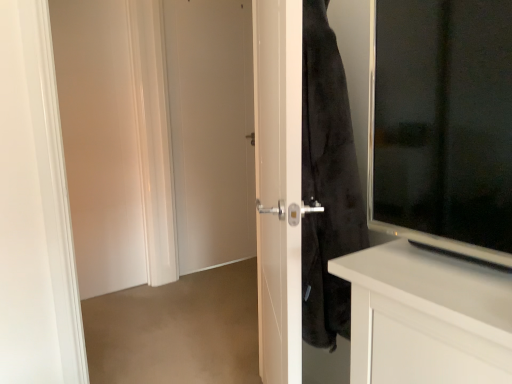
What is the approximate height of white glossy door at center, arranged as the first screen door when viewed from the right?

The height of white glossy door at center, arranged as the first screen door when viewed from the right, is 1.65 meters.

Where is `white matte door at left, the 2th screen door when ordered from front to back`? This screenshot has width=512, height=384. white matte door at left, the 2th screen door when ordered from front to back is located at coordinates (99, 143).

Is white matte door at center taller than white glossy door at center, arranged as the first screen door when viewed from the right?

Yes.

Can you tell me how much white matte door at center and white glossy door at center, which is the second screen door from back to front, differ in facing direction?

There is a 0.85-degree angle between the facing directions of white matte door at center and white glossy door at center, which is the second screen door from back to front.

Is the position of white matte door at center less distant than that of white glossy door at center, which ranks as the 2th screen door in left-to-right order?

No, white matte door at center is further to the viewer.

Is point (167, 41) closer or farther from the camera than point (102, 4)?

Clearly, point (167, 41) is more distant from the camera than point (102, 4).

Considering the positions of objects white matte door at left, which ranks as the first screen door in left-to-right order, and white glossy door at center, arranged as the first screen door when viewed from the right, in the image provided, who is in front, white matte door at left, which ranks as the first screen door in left-to-right order, or white glossy door at center, arranged as the first screen door when viewed from the right,?

white glossy door at center, arranged as the first screen door when viewed from the right.

Could you tell me if white matte door at left, the first screen door in the back-to-front sequence, is turned towards white glossy door at center, which is the second screen door from back to front?

Yes, white matte door at left, the first screen door in the back-to-front sequence, faces towards white glossy door at center, which is the second screen door from back to front.

Can white glossy door at center, which ranks as the 2th screen door in left-to-right order, be found inside white matte door at left, the 2th screen door when ordered from front to back?

No, white glossy door at center, which ranks as the 2th screen door in left-to-right order, is not inside white matte door at left, the 2th screen door when ordered from front to back.

Which is more to the left, white matte door at left, the 2th screen door positioned from the right, or white glossy door at center, positioned as the first screen door in front-to-back order?

Positioned to the left is white matte door at left, the 2th screen door positioned from the right.

Are white matte door at left, the 2th screen door when ordered from front to back, and white matte door at center located far from each other?

white matte door at left, the 2th screen door when ordered from front to back, is actually quite close to white matte door at center.

How different are the orientations of white matte door at left, the 2th screen door when ordered from front to back, and white matte door at center in degrees?

1.17 degrees.

From a real-world perspective, is white matte door at left, which ranks as the first screen door in left-to-right order, physically located above or below white matte door at center?

white matte door at left, which ranks as the first screen door in left-to-right order, is below white matte door at center.

In the image, is white matte door at left, the first screen door in the back-to-front sequence, on the left side or the right side of white matte door at center?

white matte door at left, the first screen door in the back-to-front sequence, is to the left of white matte door at center.

Could you tell me if white matte door at center is turned towards white matte door at left, the 2th screen door positioned from the right?

No, white matte door at center is not oriented towards white matte door at left, the 2th screen door positioned from the right.

How many degrees apart are the facing directions of white matte door at center and white matte door at left, which ranks as the first screen door in left-to-right order?

The facing directions of white matte door at center and white matte door at left, which ranks as the first screen door in left-to-right order, are 1.17 degrees apart.

Is point (175, 138) farther from viewer compared to point (91, 73)?

Yes, it is behind point (91, 73).

The height and width of the screenshot is (384, 512). What are the coordinates of `door that is above the white matte door at left, which ranks as the first screen door in left-to-right order (from a real-world perspective)` in the screenshot? It's located at (211, 129).

Which of these two, white glossy door at center, arranged as the first screen door when viewed from the right, or white matte door at center, is smaller?

Smaller between the two is white matte door at center.

Considering the positions of point (99, 289) and point (227, 55), is point (99, 289) closer or farther from the camera than point (227, 55)?

Point (99, 289) is positioned closer to the camera compared to point (227, 55).

Which object is further away from the camera taking this photo, white glossy door at center, arranged as the first screen door when viewed from the right, or white matte door at center?

white matte door at center is more distant.

From the image's perspective, between white glossy door at center, which is the second screen door from back to front, and white matte door at center, who is located below?

white glossy door at center, which is the second screen door from back to front.

From the picture: In terms of size, does white glossy door at center, which is the second screen door from back to front, appear bigger or smaller than white matte door at left, the 2th screen door positioned from the right?

Clearly, white glossy door at center, which is the second screen door from back to front, is larger in size than white matte door at left, the 2th screen door positioned from the right.

Is white matte door at left, the 2th screen door when ordered from front to back, at the back of white glossy door at center, arranged as the first screen door when viewed from the right?

Correct, white glossy door at center, arranged as the first screen door when viewed from the right, is looking away from white matte door at left, the 2th screen door when ordered from front to back.

Would you say white matte door at left, which ranks as the first screen door in left-to-right order, is part of white glossy door at center, which is the second screen door from back to front,'s contents?

Actually, white matte door at left, which ranks as the first screen door in left-to-right order, is outside white glossy door at center, which is the second screen door from back to front.

This screenshot has height=384, width=512. In order to click on the 2nd screen door below when counting from the white matte door at center (from the image's perspective) in this screenshot , I will do `click(232, 101)`.

Where is `screen door lying behind the white glossy door at center, which is the second screen door from back to front`? screen door lying behind the white glossy door at center, which is the second screen door from back to front is located at coordinates (99, 143).

Based on their spatial positions, is white matte door at left, the first screen door in the back-to-front sequence, or white glossy door at center, arranged as the first screen door when viewed from the right, further from white matte door at center?

Among the two, white matte door at left, the first screen door in the back-to-front sequence, is located further to white matte door at center.

From the image, which object appears to be nearer to white glossy door at center, which ranks as the 2th screen door in left-to-right order, white matte door at center or white matte door at left, the first screen door in the back-to-front sequence?

The object closer to white glossy door at center, which ranks as the 2th screen door in left-to-right order, is white matte door at center.

Looking at the image, which one is located closer to white matte door at center, white glossy door at center, positioned as the first screen door in front-to-back order, or white matte door at left, which ranks as the first screen door in left-to-right order?

Among the two, white glossy door at center, positioned as the first screen door in front-to-back order, is located nearer to white matte door at center.

When comparing their distances from white glossy door at center, arranged as the first screen door when viewed from the right, does white matte door at left, which ranks as the first screen door in left-to-right order, or white matte door at center seem closer?

white matte door at center is positioned closer to the anchor white glossy door at center, arranged as the first screen door when viewed from the right.

Looking at the image, which one is located further to white matte door at left, the first screen door in the back-to-front sequence, white matte door at center or white glossy door at center, which ranks as the 2th screen door in left-to-right order?

white matte door at center lies further to white matte door at left, the first screen door in the back-to-front sequence, than the other object.

Estimate the real-world distances between objects in this image. Which object is further from white matte door at left, which ranks as the first screen door in left-to-right order, white glossy door at center, arranged as the first screen door when viewed from the right, or white matte door at center?

white matte door at center lies further to white matte door at left, which ranks as the first screen door in left-to-right order, than the other object.

The image size is (512, 384). In order to click on screen door positioned between white glossy door at center, arranged as the first screen door when viewed from the right, and white matte door at center from near to far in this screenshot , I will do `click(99, 143)`.